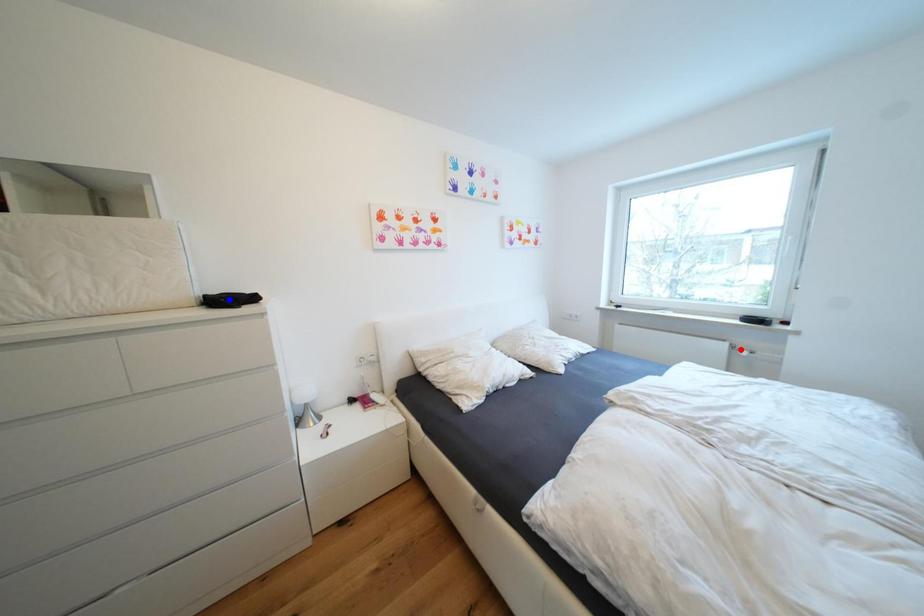
Question: Two points are marked on the image. Which point is closer to the camera?

Choices:
 (A) Blue point is closer.
 (B) Red point is closer.

Answer: (A)